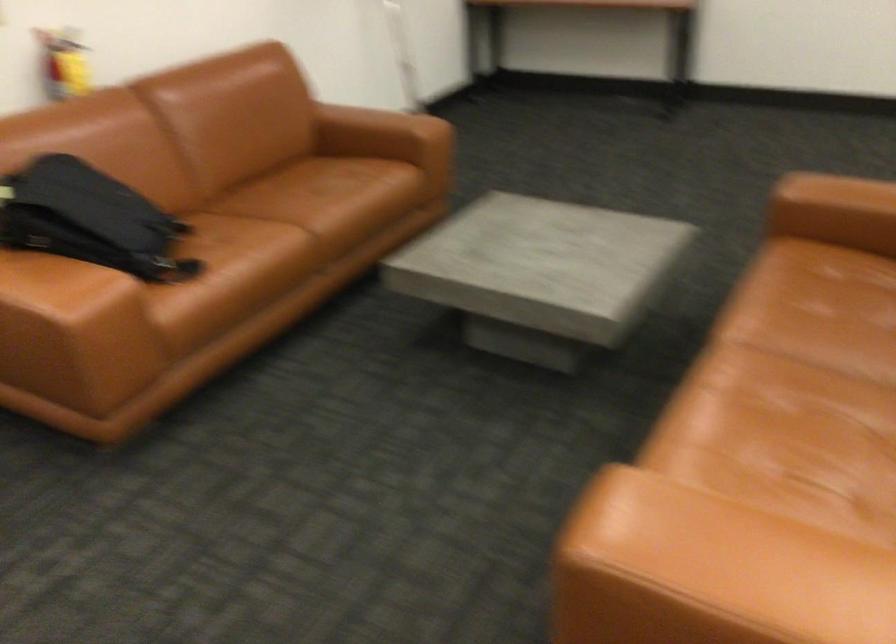
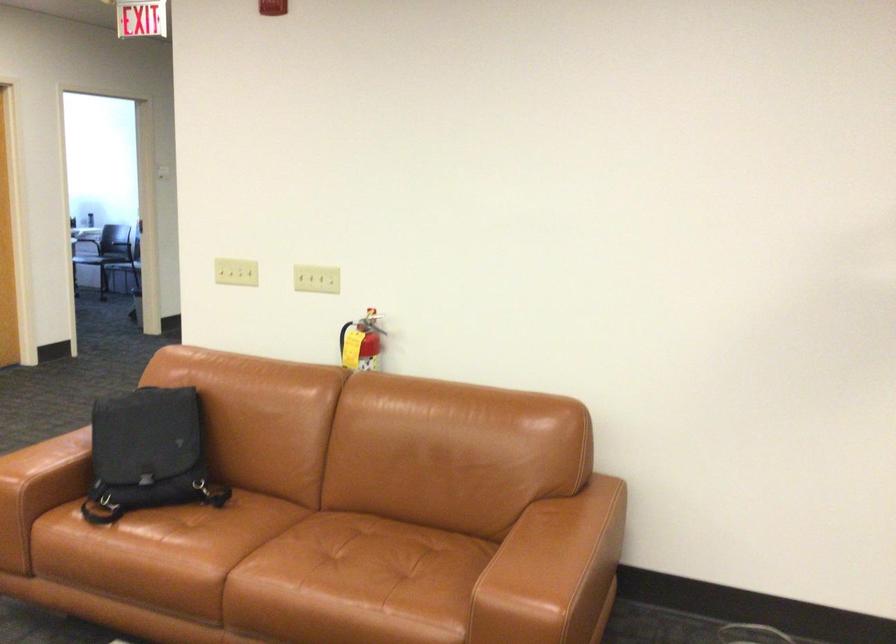
Locate, in the second image, the point that corresponds to point (130, 214) in the first image.

(148, 453)